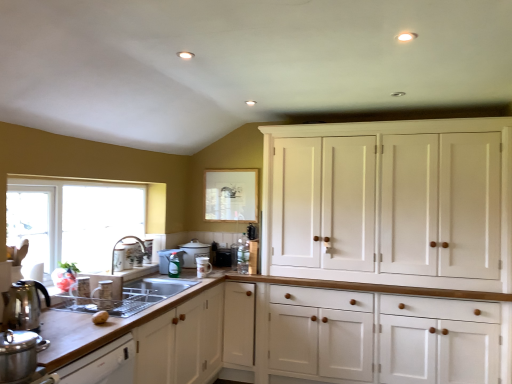
Image resolution: width=512 pixels, height=384 pixels. Describe the element at coordinates (168, 259) in the screenshot. I see `translucent plastic spray bottle at center, which is counted as the fourth appliance, starting from the front` at that location.

You are a GUI agent. You are given a task and a screenshot of the screen. Output one action in this format:
    pyautogui.click(x=<x>, y=<y>)
    Task: Click on the matte silver faucet at sink left
    The image size is (512, 384).
    Given the screenshot: What is the action you would take?
    pyautogui.click(x=122, y=240)

Where is `black matte toaster at center, which ranks as the 1th appliance in back-to-front order`? The image size is (512, 384). black matte toaster at center, which ranks as the 1th appliance in back-to-front order is located at coordinates (221, 256).

Based on the photo, is wooden countertop at lower left oriented towards matte silver faucet at sink left?

No.

Is point (100, 329) behind point (142, 242)?

No.

From the image's perspective, does wooden countertop at lower left appear lower than matte silver faucet at sink left?

Indeed, from the image's perspective, wooden countertop at lower left is shown beneath matte silver faucet at sink left.

Considering the sizes of objects wooden countertop at lower left and matte silver faucet at sink left in the image provided, who is bigger, wooden countertop at lower left or matte silver faucet at sink left?

wooden countertop at lower left.

Does translucent plastic spray bottle at center, which is counted as the fourth appliance, starting from the front, come behind stainless steel pot at lower left, which is the first appliance from front to back?

Yes, it is behind stainless steel pot at lower left, which is the first appliance from front to back.

Considering the positions of point (170, 251) and point (31, 334), is point (170, 251) closer or farther from the camera than point (31, 334)?

Clearly, point (170, 251) is more distant from the camera than point (31, 334).

Does translucent plastic spray bottle at center, marked as the 3th appliance in a back-to-front arrangement, turn towards stainless steel pot at lower left, which is the 6th appliance in back-to-front order?

No, translucent plastic spray bottle at center, marked as the 3th appliance in a back-to-front arrangement, does not turn towards stainless steel pot at lower left, which is the 6th appliance in back-to-front order.

From a real-world perspective, which is physically above, matte silver faucet at sink left or stainless steel pot at lower left, which is the first appliance from front to back?

matte silver faucet at sink left, from a real-world perspective.

Is matte silver faucet at sink left behind stainless steel pot at lower left, which is the first appliance from front to back?

Yes, matte silver faucet at sink left is further from the camera.

Considering the relative positions of matte silver faucet at sink left and stainless steel pot at lower left, which is the 6th appliance in back-to-front order, in the image provided, is matte silver faucet at sink left to the left of stainless steel pot at lower left, which is the 6th appliance in back-to-front order, from the viewer's perspective?

No, matte silver faucet at sink left is not to the left of stainless steel pot at lower left, which is the 6th appliance in back-to-front order.

Considering their positions, is black matte toaster at center, which ranks as the 1th appliance in back-to-front order, located in front of or behind matte white cup at sink, which is the 5th appliance in back-to-front order?

Visually, black matte toaster at center, which ranks as the 1th appliance in back-to-front order, is located behind matte white cup at sink, which is the 5th appliance in back-to-front order.

Which of these two, black matte toaster at center, which ranks as the sixth appliance in front-to-back order, or matte white cup at sink, which is counted as the second appliance, starting from the front, stands shorter?

With less height is black matte toaster at center, which ranks as the sixth appliance in front-to-back order.

From a real-world perspective, is black matte toaster at center, which ranks as the sixth appliance in front-to-back order, physically above matte white cup at sink, which is counted as the second appliance, starting from the front?

No, from a real-world perspective, black matte toaster at center, which ranks as the sixth appliance in front-to-back order, is not over matte white cup at sink, which is counted as the second appliance, starting from the front

From the image's perspective, is black matte toaster at center, which ranks as the 1th appliance in back-to-front order, located above or below matte white cup at sink, which is the 5th appliance in back-to-front order?

black matte toaster at center, which ranks as the 1th appliance in back-to-front order, is situated lower than matte white cup at sink, which is the 5th appliance in back-to-front order, in the image.

Which point is more forward, [131,286] or [206,271]?

Positioned in front is point [131,286].

Is satin silver sink at lower left at the right side of white ceramic mug at center, which is the third appliance from front to back?

No, satin silver sink at lower left is not to the right of white ceramic mug at center, which is the third appliance from front to back.

From a real-world perspective, does satin silver sink at lower left sit lower than white ceramic mug at center, which is the third appliance from front to back?

Yes, from a real-world perspective, satin silver sink at lower left is below white ceramic mug at center, which is the third appliance from front to back.

Which of these two, satin silver sink at lower left or white ceramic mug at center, acting as the 4th appliance starting from the back, stands taller?

With more height is white ceramic mug at center, acting as the 4th appliance starting from the back.

Can you confirm if translucent plastic spray bottle at center, marked as the 3th appliance in a back-to-front arrangement, is taller than black matte toaster at center, which ranks as the 1th appliance in back-to-front order?

Yes.

From the picture: In terms of width, does translucent plastic spray bottle at center, which is counted as the fourth appliance, starting from the front, look wider or thinner when compared to black matte toaster at center, which ranks as the 1th appliance in back-to-front order?

In the image, translucent plastic spray bottle at center, which is counted as the fourth appliance, starting from the front, appears to be wider than black matte toaster at center, which ranks as the 1th appliance in back-to-front order.

Considering the relative positions of translucent plastic spray bottle at center, marked as the 3th appliance in a back-to-front arrangement, and black matte toaster at center, which ranks as the 1th appliance in back-to-front order, in the image provided, is translucent plastic spray bottle at center, marked as the 3th appliance in a back-to-front arrangement, behind black matte toaster at center, which ranks as the 1th appliance in back-to-front order,?

That is False.

From the image's perspective, which object appears higher, translucent plastic spray bottle at center, marked as the 3th appliance in a back-to-front arrangement, or black matte toaster at center, which ranks as the sixth appliance in front-to-back order?

translucent plastic spray bottle at center, marked as the 3th appliance in a back-to-front arrangement, from the image's perspective.

Looking at this image, considering the sizes of objects white wood cabinet at upper right and matte silver faucet at sink left in the image provided, who is thinner, white wood cabinet at upper right or matte silver faucet at sink left?

matte silver faucet at sink left.

Between point (370, 178) and point (140, 240), which one is positioned in front?

The point (370, 178) is in front.

Are white wood cabinet at upper right and matte silver faucet at sink left making contact?

white wood cabinet at upper right and matte silver faucet at sink left are clearly separated.

Between white wood cabinet at upper right and matte silver faucet at sink left, which one has smaller size?

matte silver faucet at sink left is smaller.

Where is `faucet located above the wooden countertop at lower left (from the image's perspective)`? faucet located above the wooden countertop at lower left (from the image's perspective) is located at coordinates (122, 240).

In order to click on the 2nd appliance below the stainless steel pot at lower left, which is the 6th appliance in back-to-front order (from the image's perspective) in this screenshot , I will do `click(168, 259)`.

Which object lies nearer to the anchor point matte white cup at sink, which is counted as the second appliance, starting from the front, black matte toaster at center, which ranks as the sixth appliance in front-to-back order, or white ceramic mug at center, which is the third appliance from front to back?

Based on the image, white ceramic mug at center, which is the third appliance from front to back, appears to be nearer to matte white cup at sink, which is counted as the second appliance, starting from the front.

Looking at the image, which one is located closer to shiny metallic kettle at left, satin silver sink at lower left or black matte toaster at center, which ranks as the 1th appliance in back-to-front order?

Based on the image, satin silver sink at lower left appears to be nearer to shiny metallic kettle at left.

Considering their positions, is transparent glass window screen at upper center positioned further to black matte toaster at center, which ranks as the sixth appliance in front-to-back order, than brown matte potato at lower left?

The object further to black matte toaster at center, which ranks as the sixth appliance in front-to-back order, is brown matte potato at lower left.

Which object lies nearer to the anchor point matte white teapot at center, the 2th appliance in the back-to-front sequence, white wood cabinet at upper right or satin silver sink at lower left?

satin silver sink at lower left lies closer to matte white teapot at center, the 2th appliance in the back-to-front sequence, than the other object.

From the picture: Considering their positions, is wooden countertop at lower left positioned further to translucent plastic spray bottle at center, which is counted as the fourth appliance, starting from the front, than white wood cabinet at upper right?

Among the two, white wood cabinet at upper right is located further to translucent plastic spray bottle at center, which is counted as the fourth appliance, starting from the front.

Looking at the image, which one is located closer to black matte toaster at center, which ranks as the 1th appliance in back-to-front order, wooden countertop at lower left or matte white cup at sink, which is counted as the second appliance, starting from the front?

Based on the image, wooden countertop at lower left appears to be nearer to black matte toaster at center, which ranks as the 1th appliance in back-to-front order.

Based on their spatial positions, is brown matte potato at lower left or white wood cabinet at upper right closer to matte silver faucet at sink left?

brown matte potato at lower left is positioned closer to the anchor matte silver faucet at sink left.

Looking at the image, which one is located further to matte silver faucet at sink left, white wood cabinet at upper right or translucent plastic spray bottle at center, which is counted as the fourth appliance, starting from the front?

white wood cabinet at upper right is positioned further to the anchor matte silver faucet at sink left.

Find the location of a particular element. The height and width of the screenshot is (384, 512). window located between brown matte potato at lower left and white ceramic mug at center, acting as the 4th appliance starting from the back, in the depth direction is located at coordinates (75, 219).

The height and width of the screenshot is (384, 512). Identify the location of tea pot that lies between clear glass window at left and wooden countertop at lower left from top to bottom. (24, 305).

Find the location of a particular element. This screenshot has width=512, height=384. countertop between stainless steel pot at lower left, which is the first appliance from front to back, and matte white teapot at center, arranged as the fifth appliance when viewed from the front, along the z-axis is located at coordinates (102, 326).

Where is `sink between clear glass window at left and brown matte potato at lower left from left to right`? The width and height of the screenshot is (512, 384). sink between clear glass window at left and brown matte potato at lower left from left to right is located at coordinates (128, 297).